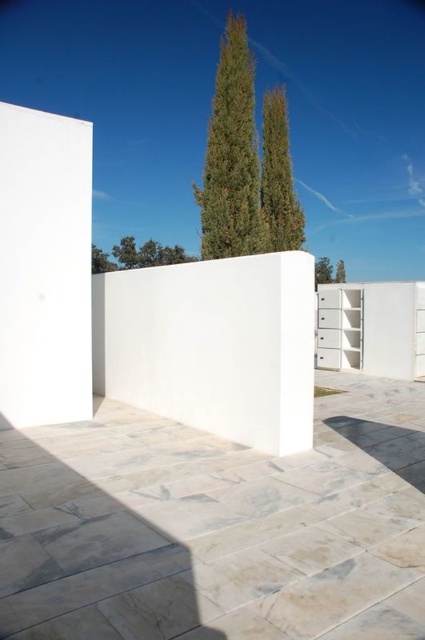
You are standing in the minimalist architectural scene under a clear blue sky. You see the green textured cypress tree at upper center. What is the exact 2D coordinate of the tree?

The green textured cypress tree at upper center is located at the 2D coordinate point of (232, 156).

You are an architect planning to install a new light fixture between the green textured cypress tree at upper center and the green leafy cypress at upper center. Which tree should the light fixture be placed closer to in order to ensure it is visible from the front of the scene?

The light fixture should be placed closer to the green textured cypress tree at upper center because it is in front of the green leafy cypress at upper center, making it more visible from the front of the scene.

You are an architect designing a garden layout and need to place a small statue between the green textured cypress tree at upper center and the green leafy cypress at upper center. Based on their positions, which tree should the statue be closer to if it needs to be near the one that is farther from the viewer?

The statue should be closer to the green leafy cypress at upper center because it is positioned farther from the viewer compared to the green textured cypress tree at upper center.